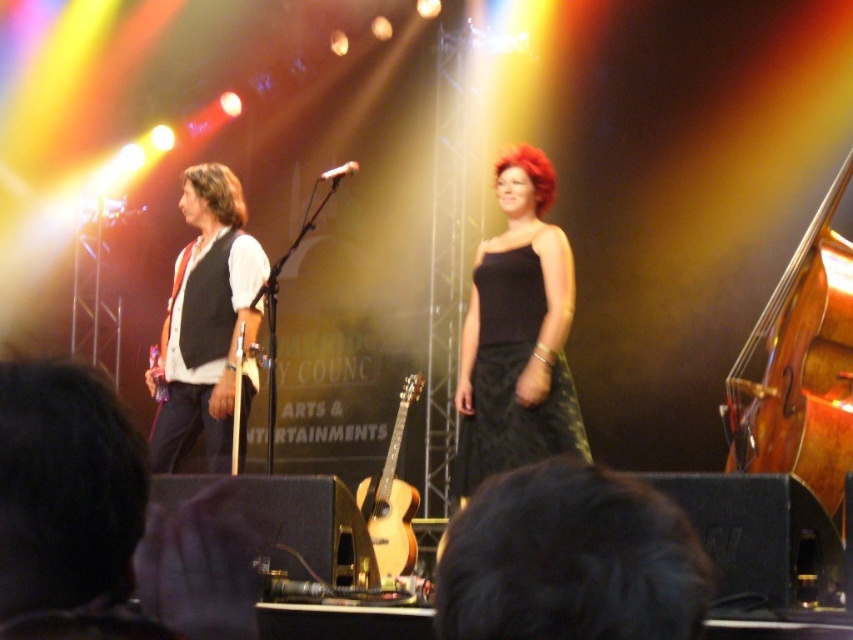
Question: Which object is the farthest from the black shiny hair at center?

Choices:
 (A) wooden polished cello at right
 (B) brown wavy hair at left
 (C) red shiny hair at center
 (D) black satin dress at center

Answer: (B)

Question: In this image, where is matte black vest at left located relative to wooden acoustic guitar at left?

Choices:
 (A) below
 (B) above

Answer: (B)

Question: Where is wooden acoustic guitar at left located in relation to red shiny hair at center in the image?

Choices:
 (A) right
 (B) left

Answer: (B)

Question: Which of the following is the closest to the observer?

Choices:
 (A) (239, 237)
 (B) (537, 182)

Answer: (B)

Question: Is wooden polished cello at right positioned behind silver metallic microphone at center?

Choices:
 (A) yes
 (B) no

Answer: (B)

Question: Which point is closer to the camera taking this photo?

Choices:
 (A) (508, 154)
 (B) (256, 364)
 (C) (235, 280)

Answer: (C)